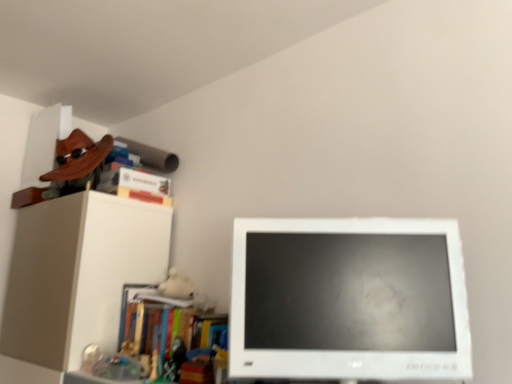
Question: From a real-world perspective, is wooden skateboard at upper left, marked as the 1th book in a top-to-bottom arrangement, over white glossy computer monitor at center?

Choices:
 (A) no
 (B) yes

Answer: (B)

Question: Is wooden skateboard at upper left, marked as the 1th book in a top-to-bottom arrangement, aimed at white glossy computer monitor at center?

Choices:
 (A) yes
 (B) no

Answer: (B)

Question: Considering the relative sizes of wooden skateboard at upper left, marked as the 1th book in a top-to-bottom arrangement, and white glossy computer monitor at center in the image provided, is wooden skateboard at upper left, marked as the 1th book in a top-to-bottom arrangement, wider than white glossy computer monitor at center?

Choices:
 (A) yes
 (B) no

Answer: (A)

Question: Considering the relative positions of wooden skateboard at upper left, the fourth book when ordered from bottom to top, and white glossy computer monitor at center in the image provided, is wooden skateboard at upper left, the fourth book when ordered from bottom to top, behind white glossy computer monitor at center?

Choices:
 (A) no
 (B) yes

Answer: (B)

Question: Can you see wooden skateboard at upper left, the fourth book when ordered from bottom to top, touching white glossy computer monitor at center?

Choices:
 (A) yes
 (B) no

Answer: (B)

Question: Would you say wooden skateboard at upper left, the fourth book when ordered from bottom to top, is to the left or to the right of hardcover book at upper left, the second book positioned from the bottom, in the picture?

Choices:
 (A) left
 (B) right

Answer: (A)

Question: Is point (132, 190) positioned closer to the camera than point (114, 193)?

Choices:
 (A) farther
 (B) closer

Answer: (A)

Question: From a real-world perspective, is wooden skateboard at upper left, marked as the 1th book in a top-to-bottom arrangement, positioned above or below hardcover book at upper left, which is the 3th book from top to bottom?

Choices:
 (A) above
 (B) below

Answer: (A)

Question: From the image's perspective, is wooden skateboard at upper left, marked as the 1th book in a top-to-bottom arrangement, located above or below hardcover book at upper left, which is the 3th book from top to bottom?

Choices:
 (A) above
 (B) below

Answer: (A)

Question: Which is correct: hardcover book at upper left, the second book positioned from the bottom, is inside multicolored plastic books at left, the first book positioned from the bottom, or outside of it?

Choices:
 (A) inside
 (B) outside

Answer: (B)

Question: From a real-world perspective, is hardcover book at upper left, which is the 3th book from top to bottom, above or below multicolored plastic books at left, the first book positioned from the bottom?

Choices:
 (A) above
 (B) below

Answer: (A)

Question: From the image's perspective, relative to multicolored plastic books at left, marked as the fourth book in a top-to-bottom arrangement, is hardcover book at upper left, which is the 3th book from top to bottom, above or below?

Choices:
 (A) below
 (B) above

Answer: (B)

Question: From their relative heights in the image, would you say hardcover book at upper left, the second book positioned from the bottom, is taller or shorter than multicolored plastic books at left, the first book positioned from the bottom?

Choices:
 (A) short
 (B) tall

Answer: (A)

Question: Considering the relative positions of multicolored plastic books at left, marked as the fourth book in a top-to-bottom arrangement, and hardcover book at upper left, which is the 3th book from top to bottom, in the image provided, is multicolored plastic books at left, marked as the fourth book in a top-to-bottom arrangement, to the left or to the right of hardcover book at upper left, which is the 3th book from top to bottom,?

Choices:
 (A) left
 (B) right

Answer: (B)

Question: From the image's perspective, is multicolored plastic books at left, marked as the fourth book in a top-to-bottom arrangement, positioned above or below hardcover book at upper left, which is the 3th book from top to bottom?

Choices:
 (A) below
 (B) above

Answer: (A)